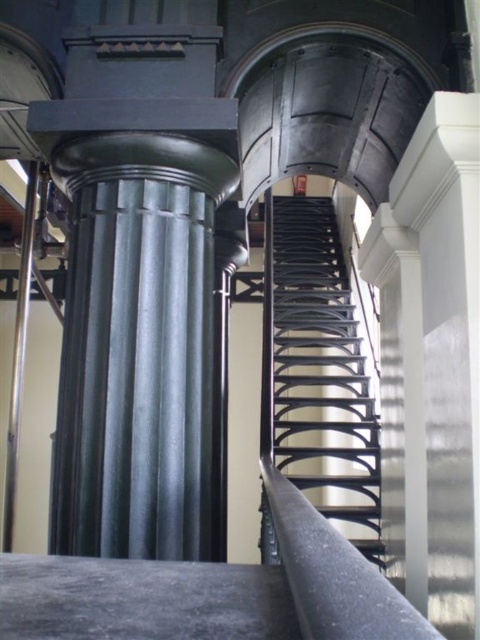
Question: Which of the following is the farthest from the observer?

Choices:
 (A) (267, 244)
 (B) (34, 216)

Answer: (A)

Question: Where is black metal staircase at center located in relation to silver metallic pole at left in the image?

Choices:
 (A) left
 (B) right

Answer: (B)

Question: Does black metal staircase at center have a larger size compared to silver metallic pole at left?

Choices:
 (A) no
 (B) yes

Answer: (B)

Question: Is black metal staircase at center below silver metallic pole at left?

Choices:
 (A) no
 (B) yes

Answer: (A)

Question: Which point appears closest to the camera in this image?

Choices:
 (A) (314, 436)
 (B) (10, 413)

Answer: (B)

Question: Which of the following is the farthest from the observer?

Choices:
 (A) (23, 276)
 (B) (317, 493)

Answer: (B)